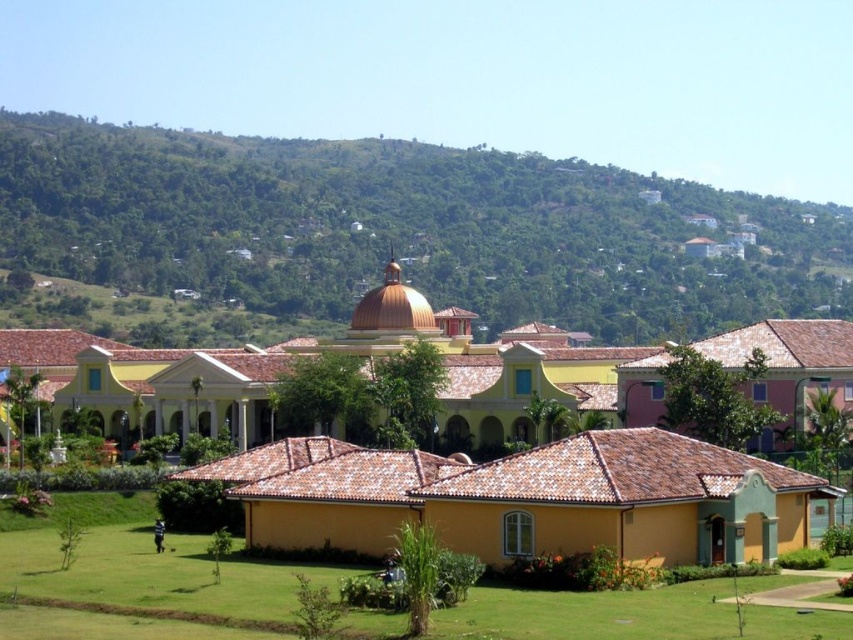
Question: Which point appears closest to the camera in this image?

Choices:
 (A) (595, 612)
 (B) (144, 198)

Answer: (A)

Question: Which of the following is the closest to the observer?

Choices:
 (A) (538, 605)
 (B) (250, 138)

Answer: (A)

Question: Can you confirm if green leafy hillside at upper center is bigger than green grass lawn at lower left?

Choices:
 (A) no
 (B) yes

Answer: (B)

Question: Can you confirm if green leafy hillside at upper center is wider than green grass lawn at lower left?

Choices:
 (A) yes
 (B) no

Answer: (A)

Question: Can you confirm if green leafy hillside at upper center is smaller than green grass lawn at lower left?

Choices:
 (A) no
 (B) yes

Answer: (A)

Question: Which object is farther from the camera taking this photo?

Choices:
 (A) green leafy hillside at upper center
 (B) green grass lawn at lower left

Answer: (A)